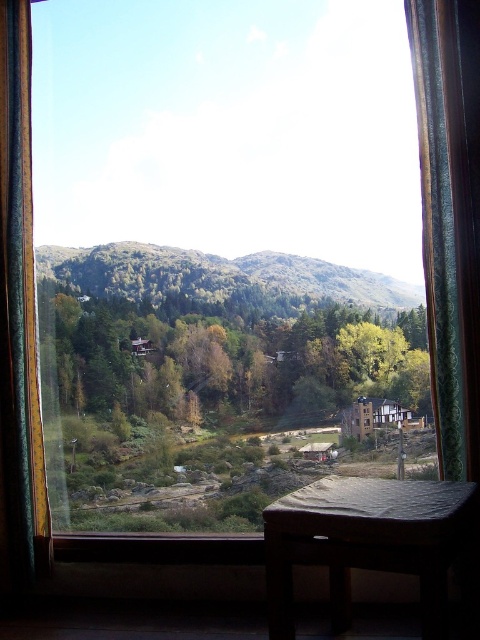
Is green textured curtain at right positioned in front of green fabric curtain at left?

Yes, it is in front of green fabric curtain at left.

From the picture: Can you confirm if green textured curtain at right is positioned to the right of green fabric curtain at left?

Yes, green textured curtain at right is to the right of green fabric curtain at left.

Does point (442, 154) come closer to viewer compared to point (33, 408)?

Yes.

Where is `green textured curtain at right`? This screenshot has height=640, width=480. green textured curtain at right is located at coordinates (450, 218).

Who is more distant from viewer, (x=10, y=76) or (x=63, y=280)?

Point (x=63, y=280)

Consider the image. Which is more to the left, green fabric curtain at left or green leafy forest at center?

green fabric curtain at left is more to the left.

Image resolution: width=480 pixels, height=640 pixels. Find the location of `green fabric curtain at left`. green fabric curtain at left is located at coordinates (19, 323).

Does transparent glass window at center have a greater height compared to green leafy forest at center?

Yes, transparent glass window at center is taller than green leafy forest at center.

Between transparent glass window at center and green leafy forest at center, which one appears on the right side from the viewer's perspective?

From the viewer's perspective, transparent glass window at center appears more on the right side.

Between point (422, 358) and point (240, 304), which one is positioned in front?

Point (422, 358) is in front.

This screenshot has width=480, height=640. I want to click on transparent glass window at center, so click(x=218, y=380).